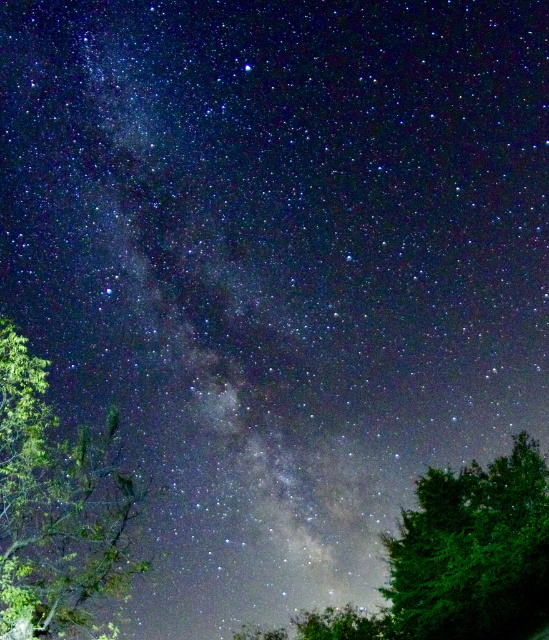
You are an astronomer observing the night sky and want to determine which tree is narrower between the green leafy tree at lower left and the green leafy tree at lower right. Which one is narrower?

The green leafy tree at lower left is narrower than the green leafy tree at lower right because it has a lesser width compared to the latter.

You are standing in a field under the night sky shown in the image. There is a point at coordinate [42,422] that you want to reach. If you can walk 100 feet in 5 minutes, how long will it take you to reach the point?

The point at coordinate [42,422] is 84.69 feet away from you. Since you can walk 100 feet in 5 minutes, it will take approximately 4.23 minutes to reach the point.

You are an astronomer analyzing the night sky image. The Milky Way is visible as a luminous band stretching from the bottom left to the upper right. Where is the green leafy tree at lower left located in terms of its 2D coordinates?

The green leafy tree at lower left is located at the 2D coordinates of point (55, 502).